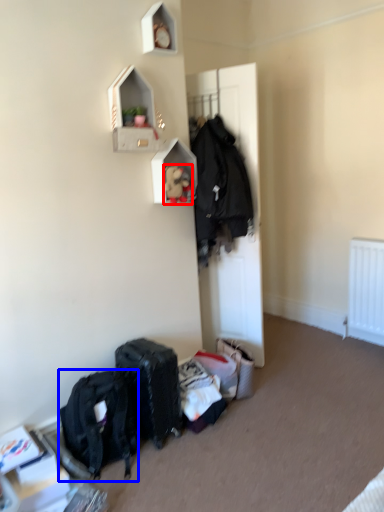
Question: Which object appears farthest to the camera in this image, toy (highlighted by a red box) or backpack (highlighted by a blue box)?

Choices:
 (A) toy
 (B) backpack

Answer: (A)